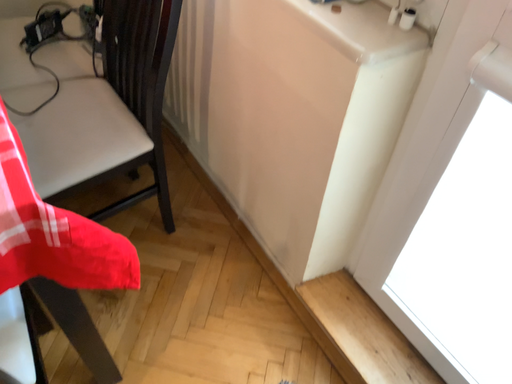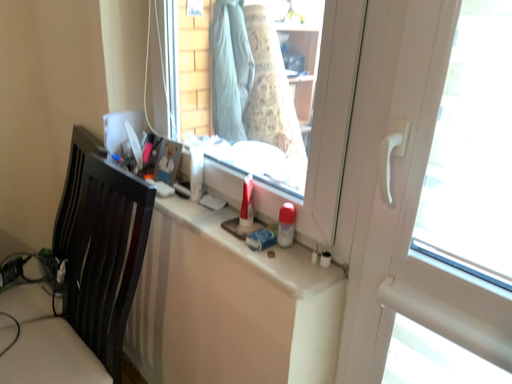
Question: Which way did the camera rotate in the video?

Choices:
 (A) rotated upward
 (B) rotated downward

Answer: (A)